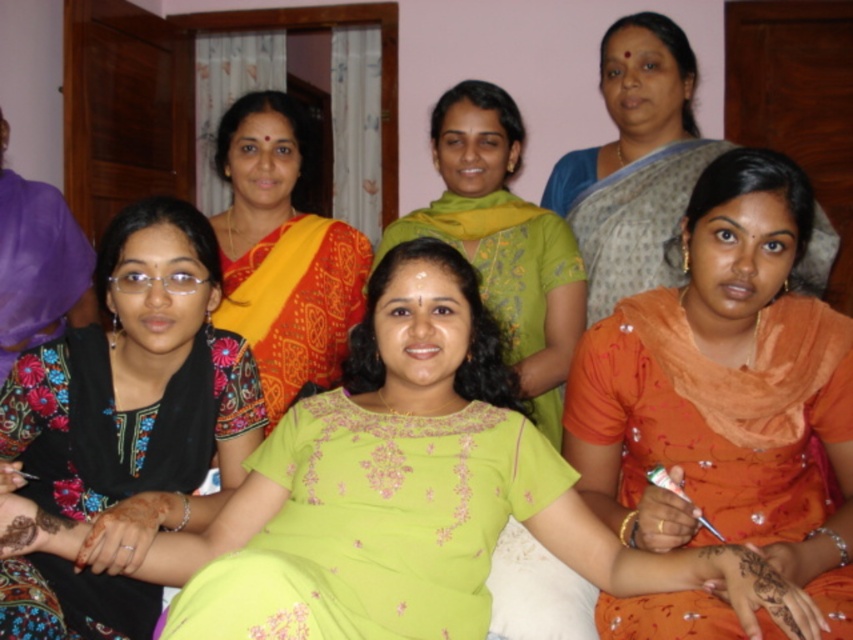
You are standing in the room where the women are seated. You want to walk towards the point that is closer to you. Which point should you head towards, point (654, 218) or point (80, 323)?

You should head towards point (654, 218) because it is closer to you than point (80, 323).

You are a fashion designer observing the women in the scene. You need to determine which garment is placed on top of the other between the orange satin saree at lower right and the floral fabric blouse at center. Which one is on top?

The orange satin saree at lower right is positioned over the floral fabric blouse at center, so the orange satin saree at lower right is on top.

You are an interior designer arranging a photo shoot. You need to place a 1.2 meter tall decorative vase between the orange satin saree at lower right and the floral fabric blouse at center. Will the vase fit vertically between them?

The orange satin saree at lower right is taller than the floral fabric blouse at center. Since the vase is 1.2 meters tall, it may not fit vertically if the space between them is less than 1.2 meters. However, the height comparison between the objects doesn t provide information about the horizontal distance between them. You need to check the horizontal spacing separately.